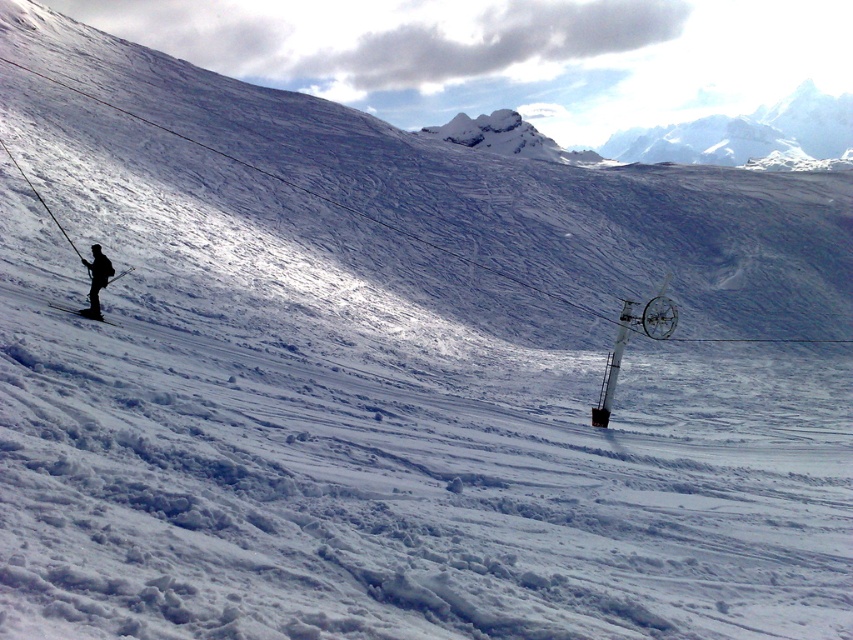
Is white plastic ski lift at right further to camera compared to black matte ski at lower left?

Yes, it is behind black matte ski at lower left.

Is point (601, 424) behind point (120, 324)?

That is True.

Which is behind, point (654, 301) or point (62, 310)?

The point (654, 301) is behind.

In order to click on white plastic ski lift at right in this screenshot , I will do coord(625,339).

Who is more distant from viewer, (676, 317) or (90, 273)?

The point (676, 317) is behind.

Between point (651, 308) and point (99, 262), which one is positioned in front?

Positioned in front is point (99, 262).

Where is `white plastic ski lift at right`? white plastic ski lift at right is located at coordinates (625, 339).

This screenshot has height=640, width=853. What are the coordinates of `white plastic ski lift at right` in the screenshot? It's located at (625, 339).

From the picture: Can you confirm if black matte skier at left is smaller than black matte ski at lower left?

Yes, black matte skier at left is smaller than black matte ski at lower left.

Is black matte skier at left taller than black matte ski at lower left?

No, black matte skier at left is not taller than black matte ski at lower left.

Describe the element at coordinates (96, 280) in the screenshot. I see `black matte skier at left` at that location.

You are a GUI agent. You are given a task and a screenshot of the screen. Output one action in this format:
    pyautogui.click(x=<x>, y=<y>)
    Task: Click on the black matte skier at left
    The image size is (853, 640).
    Given the screenshot: What is the action you would take?
    pyautogui.click(x=96, y=280)